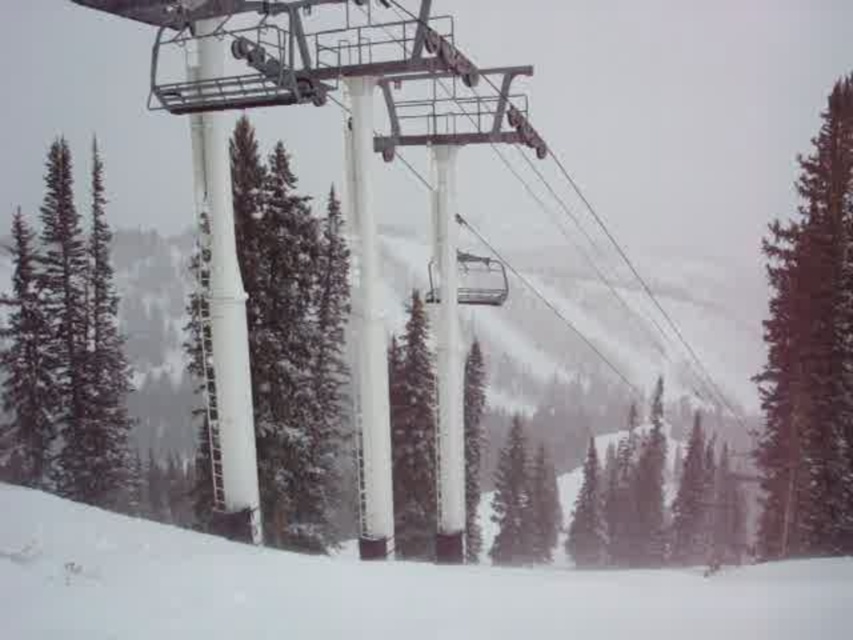
Question: Among these points, which one is nearest to the camera?

Choices:
 (A) (810, 509)
 (B) (198, 298)

Answer: (B)

Question: Can you confirm if white snow at lower center is positioned below green matte evergreen tree at left?

Choices:
 (A) yes
 (B) no

Answer: (A)

Question: Which point appears closest to the camera in this image?

Choices:
 (A) (80, 292)
 (B) (202, 449)
 (C) (206, 625)

Answer: (C)

Question: Which object is the closest to the green matte evergreen tree at left?

Choices:
 (A) snow-covered pine tree at right
 (B) white snow at lower center
 (C) white matte pole at center
 (D) green matte tree at center

Answer: (C)

Question: From the image, what is the correct spatial relationship of white snow at lower center in relation to snow-covered pine tree at right?

Choices:
 (A) above
 (B) below

Answer: (B)

Question: Is snow-covered pine tree at right above green matte tree at center?

Choices:
 (A) no
 (B) yes

Answer: (B)